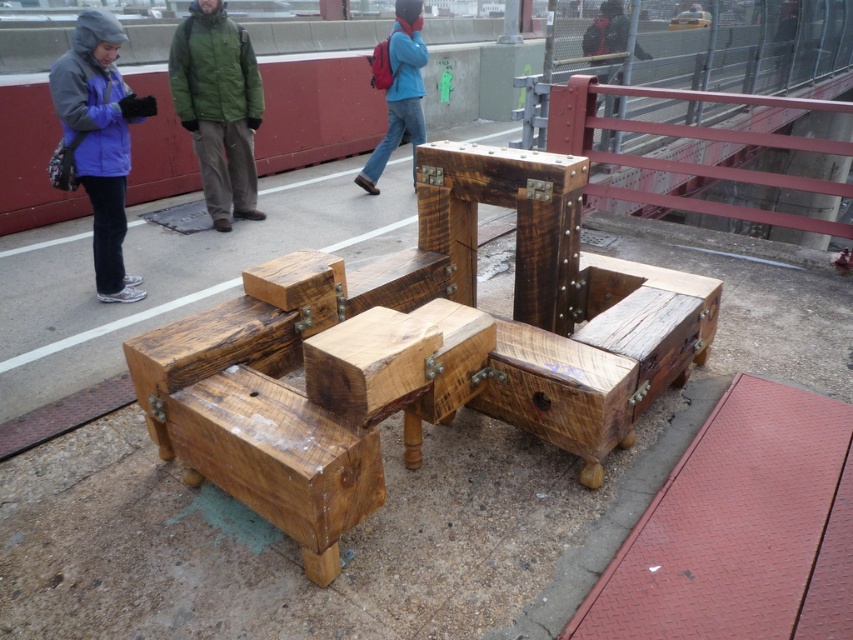
From the picture: Between smooth metal rail at upper right and dark gray jacket at upper left, which one has more height?

smooth metal rail at upper right is taller.

Is smooth metal rail at upper right above dark gray jacket at upper left?

Actually, smooth metal rail at upper right is below dark gray jacket at upper left.

Who is more distant from viewer, (611, 116) or (602, 38)?

Positioned behind is point (611, 116).

Locate an element on the screen. smooth metal rail at upper right is located at coordinates (692, 148).

Which is behind, point (527, 214) or point (412, 346)?

The point (527, 214) is behind.

Between point (467, 301) and point (415, 390), which one is positioned in front?

Point (415, 390) is more forward.

Where is `dark brown wood at center`? The width and height of the screenshot is (853, 640). dark brown wood at center is located at coordinates (515, 221).

Is green woolen jacket at center to the left of dark gray jacket at upper left from the viewer's perspective?

Indeed, green woolen jacket at center is positioned on the left side of dark gray jacket at upper left.

Where is `green woolen jacket at center`? This screenshot has height=640, width=853. green woolen jacket at center is located at coordinates (218, 106).

Where is `green woolen jacket at center`? green woolen jacket at center is located at coordinates (218, 106).